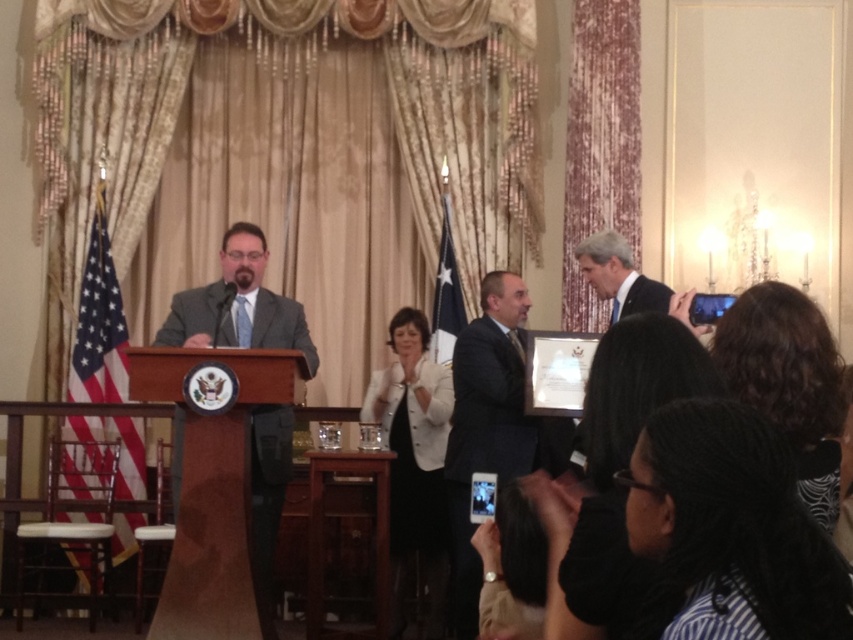
Question: Among these objects, which one is nearest to the camera?

Choices:
 (A) dark gray suit at center
 (B) matte gray suit at left

Answer: (B)

Question: Does matte gray suit at left lie in front of dark blue suit at center?

Choices:
 (A) yes
 (B) no

Answer: (A)

Question: Considering the real-world distances, which object is farthest from the matte gray suit at left?

Choices:
 (A) dark gray suit at center
 (B) dark blue suit at center

Answer: (B)

Question: Which point is farther to the camera?

Choices:
 (A) matte gray suit at left
 (B) dark blue suit at center

Answer: (B)

Question: Is matte gray suit at left to the right of dark blue suit at center from the viewer's perspective?

Choices:
 (A) no
 (B) yes

Answer: (A)

Question: Is matte gray suit at left positioned in front of dark gray suit at center?

Choices:
 (A) no
 (B) yes

Answer: (B)